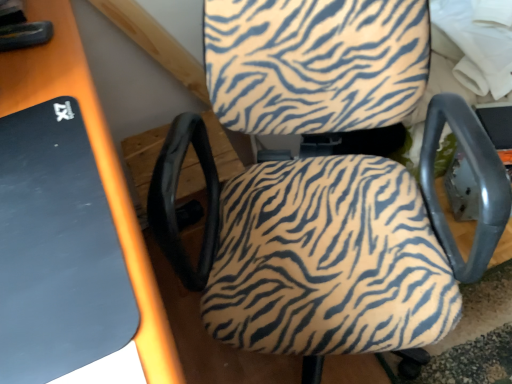
This screenshot has height=384, width=512. Describe the element at coordinates (96, 165) in the screenshot. I see `black matte mousepad at left` at that location.

Measure the distance between point (63, 79) and camera.

The distance of point (63, 79) from camera is 27.28 inches.

I want to click on black matte mousepad at left, so click(96, 165).

Find the location of a particular element. The height and width of the screenshot is (384, 512). zebra-patterned fabric chair at center is located at coordinates (318, 185).

This screenshot has height=384, width=512. What do you see at coordinates (318, 185) in the screenshot?
I see `zebra-patterned fabric chair at center` at bounding box center [318, 185].

Identify the location of black matte mousepad at left. The image size is (512, 384). (96, 165).

Which is more to the right, black matte mousepad at left or zebra-patterned fabric chair at center?

Positioned to the right is zebra-patterned fabric chair at center.

Relative to zebra-patterned fabric chair at center, is black matte mousepad at left in front or behind?

Visually, black matte mousepad at left is located behind zebra-patterned fabric chair at center.

Is point (119, 236) behind point (270, 116)?

That is False.

From the image's perspective, is black matte mousepad at left above or below zebra-patterned fabric chair at center?

Based on their image positions, black matte mousepad at left is located beneath zebra-patterned fabric chair at center.

From a real-world perspective, is black matte mousepad at left on top of zebra-patterned fabric chair at center?

Indeed, from a real-world perspective, black matte mousepad at left stands above zebra-patterned fabric chair at center.

Looking at their sizes, would you say black matte mousepad at left is wider or thinner than zebra-patterned fabric chair at center?

In the image, black matte mousepad at left appears to be more narrow than zebra-patterned fabric chair at center.

Based on the photo, considering the sizes of black matte mousepad at left and zebra-patterned fabric chair at center in the image, is black matte mousepad at left taller or shorter than zebra-patterned fabric chair at center?

Considering their sizes, black matte mousepad at left has less height than zebra-patterned fabric chair at center.

Considering the sizes of black matte mousepad at left and zebra-patterned fabric chair at center in the image, is black matte mousepad at left bigger or smaller than zebra-patterned fabric chair at center?

black matte mousepad at left is smaller than zebra-patterned fabric chair at center.

Is black matte mousepad at left not inside zebra-patterned fabric chair at center?

That's correct, black matte mousepad at left is outside of zebra-patterned fabric chair at center.

In the scene shown: Is black matte mousepad at left touching zebra-patterned fabric chair at center?

black matte mousepad at left and zebra-patterned fabric chair at center are not in contact.

Is black matte mousepad at left aimed at zebra-patterned fabric chair at center?

Yes, black matte mousepad at left is aimed at zebra-patterned fabric chair at center.

Can you tell me how much black matte mousepad at left and zebra-patterned fabric chair at center differ in facing direction?

The facing directions of black matte mousepad at left and zebra-patterned fabric chair at center are 113 degrees apart.

How distant is black matte mousepad at left from zebra-patterned fabric chair at center?

A distance of 16.01 inches exists between black matte mousepad at left and zebra-patterned fabric chair at center.

Identify the location of chair that appears above the black matte mousepad at left (from the image's perspective). This screenshot has height=384, width=512. (318, 185).

Considering the positions of objects zebra-patterned fabric chair at center and black matte mousepad at left in the image provided, who is more to the right, zebra-patterned fabric chair at center or black matte mousepad at left?

zebra-patterned fabric chair at center.

Is zebra-patterned fabric chair at center in front of or behind black matte mousepad at left in the image?

Visually, zebra-patterned fabric chair at center is located in front of black matte mousepad at left.

Is point (286, 306) more distant than point (114, 192)?

That is True.

From the image's perspective, which one is positioned lower, zebra-patterned fabric chair at center or black matte mousepad at left?

black matte mousepad at left.

From a real-world perspective, is zebra-patterned fabric chair at center physically located above or below black matte mousepad at left?

zebra-patterned fabric chair at center is situated lower than black matte mousepad at left in the real world.

Does zebra-patterned fabric chair at center have a lesser width compared to black matte mousepad at left?

Incorrect, the width of zebra-patterned fabric chair at center is not less than that of black matte mousepad at left.

Considering the sizes of objects zebra-patterned fabric chair at center and black matte mousepad at left in the image provided, who is shorter, zebra-patterned fabric chair at center or black matte mousepad at left?

Standing shorter between the two is black matte mousepad at left.

Consider the image. Is zebra-patterned fabric chair at center bigger or smaller than black matte mousepad at left?

zebra-patterned fabric chair at center is bigger than black matte mousepad at left.

Is zebra-patterned fabric chair at center situated inside black matte mousepad at left or outside?

zebra-patterned fabric chair at center is outside black matte mousepad at left.

Based on the photo, can you see zebra-patterned fabric chair at center touching black matte mousepad at left?

zebra-patterned fabric chair at center and black matte mousepad at left are clearly separated.

Does zebra-patterned fabric chair at center turn towards black matte mousepad at left?

No.

How different are the orientations of zebra-patterned fabric chair at center and black matte mousepad at left in degrees?

The facing directions of zebra-patterned fabric chair at center and black matte mousepad at left are 113 degrees apart.

Where is `table located below the zebra-patterned fabric chair at center (from the image's perspective)`? The width and height of the screenshot is (512, 384). table located below the zebra-patterned fabric chair at center (from the image's perspective) is located at coordinates (96, 165).

Identify the location of table on the left of zebra-patterned fabric chair at center. This screenshot has width=512, height=384. (96, 165).

The image size is (512, 384). I want to click on table behind the zebra-patterned fabric chair at center, so click(96, 165).